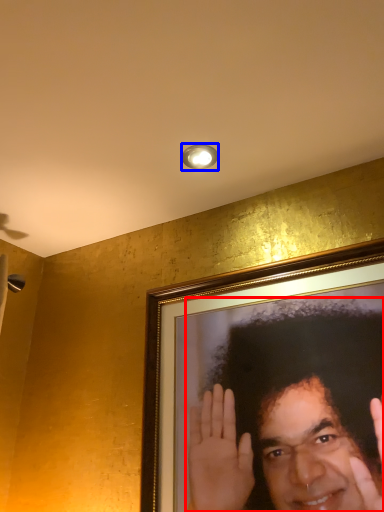
Question: Which of the following is the closest to the observer, man (highlighted by a red box) or light fixture (highlighted by a blue box)?

Choices:
 (A) man
 (B) light fixture

Answer: (A)